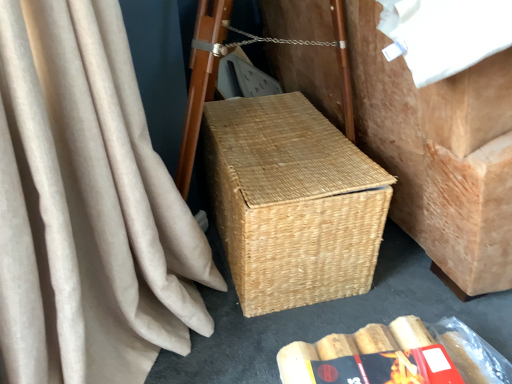
Question: Can you confirm if natural woven basket at center is shorter than natural woven picnic basket at center?

Choices:
 (A) no
 (B) yes

Answer: (A)

Question: Considering the relative sizes of natural woven basket at center and natural woven picnic basket at center in the image provided, is natural woven basket at center taller than natural woven picnic basket at center?

Choices:
 (A) no
 (B) yes

Answer: (B)

Question: Is natural woven basket at center positioned in front of natural woven picnic basket at center?

Choices:
 (A) no
 (B) yes

Answer: (B)

Question: Is natural woven basket at center further to the viewer compared to natural woven picnic basket at center?

Choices:
 (A) no
 (B) yes

Answer: (A)

Question: Is natural woven basket at center facing away from natural woven picnic basket at center?

Choices:
 (A) no
 (B) yes

Answer: (B)

Question: From the image's perspective, is natural woven picnic basket at center positioned above or below red matte paperback book at lower center?

Choices:
 (A) below
 (B) above

Answer: (B)

Question: Is natural woven picnic basket at center situated inside red matte paperback book at lower center or outside?

Choices:
 (A) inside
 (B) outside

Answer: (B)

Question: Considering the positions of point (296, 183) and point (423, 350), is point (296, 183) closer or farther from the camera than point (423, 350)?

Choices:
 (A) closer
 (B) farther

Answer: (B)

Question: In the image, is natural woven picnic basket at center on the left side or the right side of red matte paperback book at lower center?

Choices:
 (A) left
 (B) right

Answer: (A)

Question: Considering the positions of point (440, 332) and point (331, 157), is point (440, 332) closer or farther from the camera than point (331, 157)?

Choices:
 (A) closer
 (B) farther

Answer: (A)

Question: Is woven brown basket at center bigger or smaller than natural woven picnic basket at center?

Choices:
 (A) small
 (B) big

Answer: (A)

Question: Is woven brown basket at center to the left or to the right of natural woven picnic basket at center in the image?

Choices:
 (A) right
 (B) left

Answer: (A)

Question: Considering the positions of woven brown basket at center and natural woven picnic basket at center in the image, is woven brown basket at center wider or thinner than natural woven picnic basket at center?

Choices:
 (A) thin
 (B) wide

Answer: (B)

Question: In the image, is red matte paperback book at lower center positioned in front of or behind woven brown basket at center?

Choices:
 (A) front
 (B) behind

Answer: (A)

Question: Is red matte paperback book at lower center to the left or to the right of woven brown basket at center in the image?

Choices:
 (A) right
 (B) left

Answer: (B)